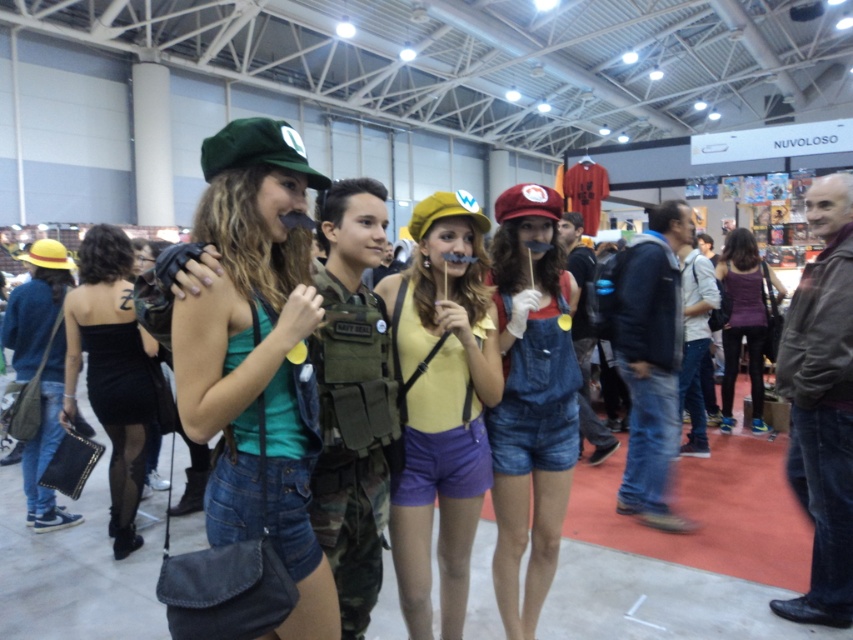
You are standing at the camera position and want to grab the matte green cap at upper left. Can you reach it without moving your feet?

The matte green cap at upper left is 1.26 meters from camera, so yes, you can reach it without moving your feet since it is within arm reach.

You are a photographer at the event and need to take a photo of the two people wearing the yellow matte tank top at center and the purple matte tank top at center. Which tank top is shorter in length?

The yellow matte tank top at center is shorter than the purple matte tank top at center.